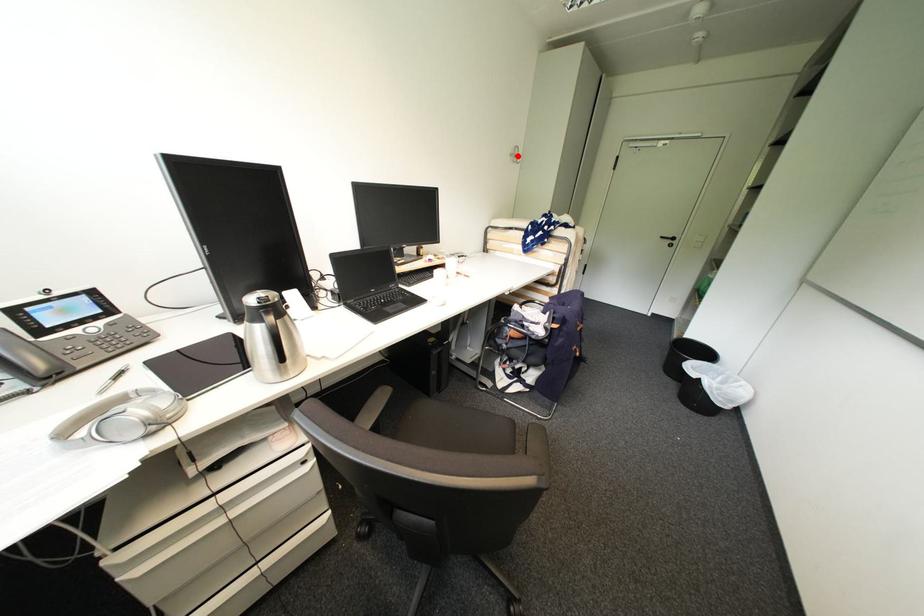
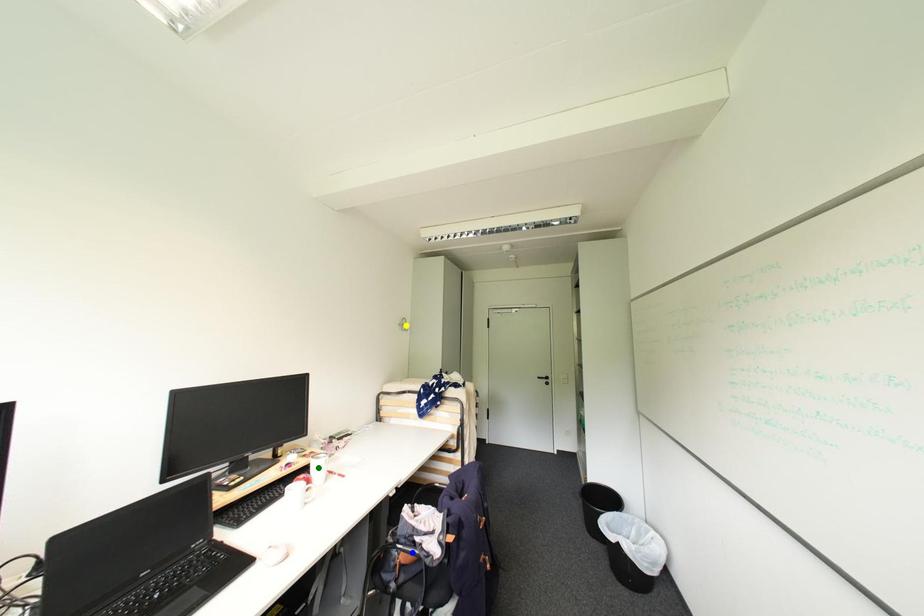
Question: I am providing you with two images of the same scene from different viewpoints. A red point is marked on the first image. You are given multiple points on the second image. In image 2, which mark is for the same physical point as the one in image 1?

Choices:
 (A) green point
 (B) yellow point
 (C) blue point

Answer: (B)